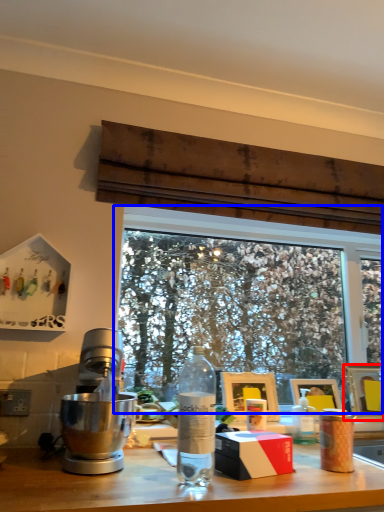
Question: Which point is closer to the camera, picture frame (highlighted by a red box) or window (highlighted by a blue box)?

Choices:
 (A) picture frame
 (B) window

Answer: (B)